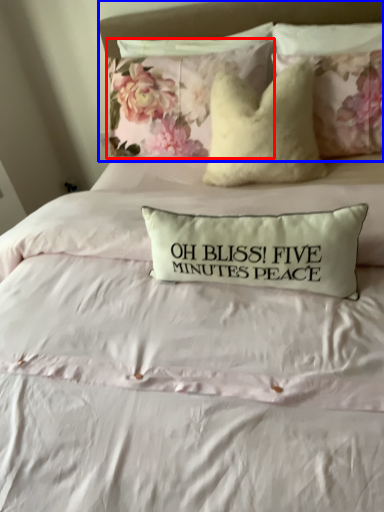
Question: Which object appears farthest to the camera in this image, pillow (highlighted by a red box) or headboard (highlighted by a blue box)?

Choices:
 (A) pillow
 (B) headboard

Answer: (A)